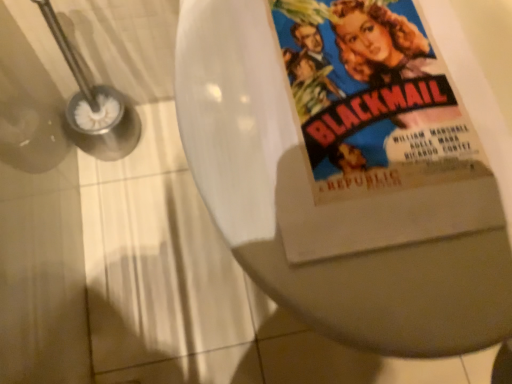
What do you see at coordinates (333, 258) in the screenshot?
I see `white glossy toilet seat at upper center` at bounding box center [333, 258].

Measure the distance between white glossy toilet seat at upper center and camera.

The distance of white glossy toilet seat at upper center from camera is 12.21 inches.

Where is `white glossy toilet seat at upper center`? Image resolution: width=512 pixels, height=384 pixels. white glossy toilet seat at upper center is located at coordinates (333, 258).

Where is `white glossy toilet seat at upper center`? Image resolution: width=512 pixels, height=384 pixels. white glossy toilet seat at upper center is located at coordinates (333, 258).